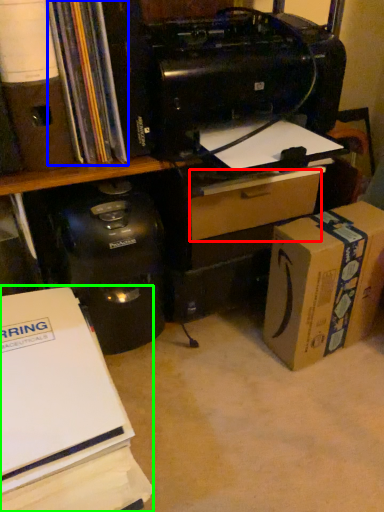
Question: Which is farther away from drawer (highlighted by a red box)? book (highlighted by a blue box) or office supplies (highlighted by a green box)?

Choices:
 (A) book
 (B) office supplies

Answer: (B)